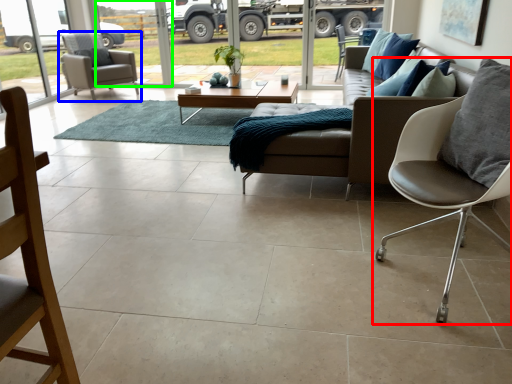
Question: Considering the real-world distances, which object is farthest from chair (highlighted by a red box)? chair (highlighted by a blue box) or window screen (highlighted by a green box)?

Choices:
 (A) chair
 (B) window screen

Answer: (B)